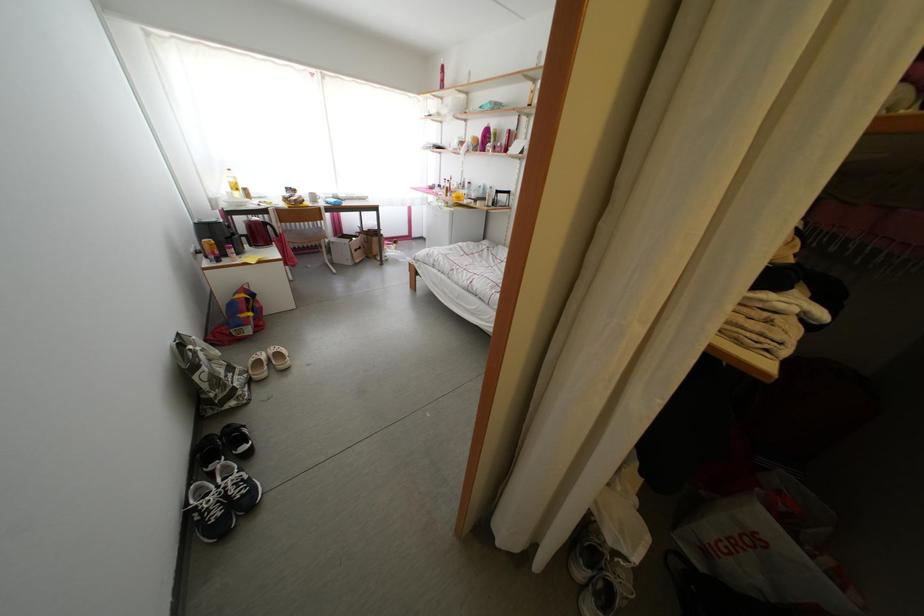
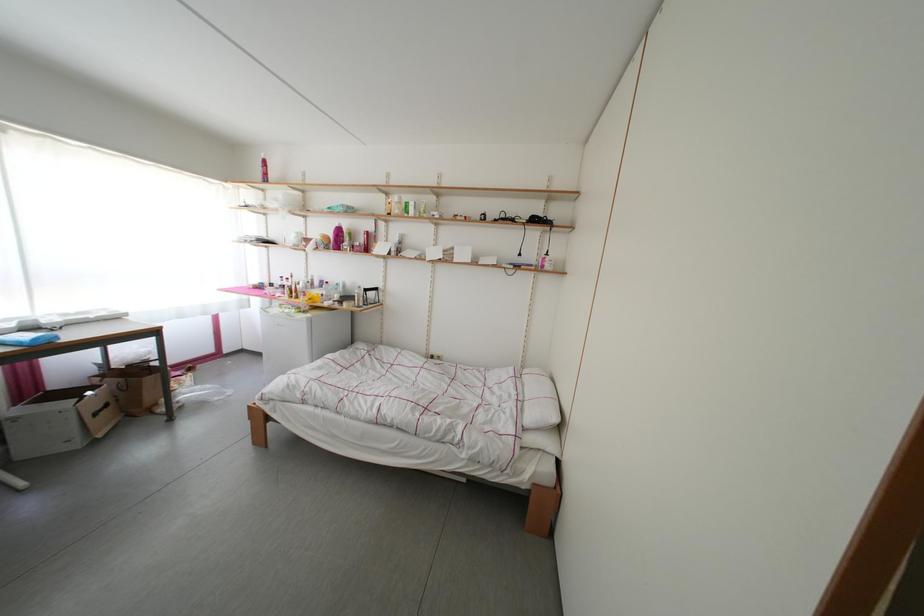
Question: How did the camera likely rotate?

Choices:
 (A) Left
 (B) Right
 (C) Up
 (D) Down

Answer: (B)